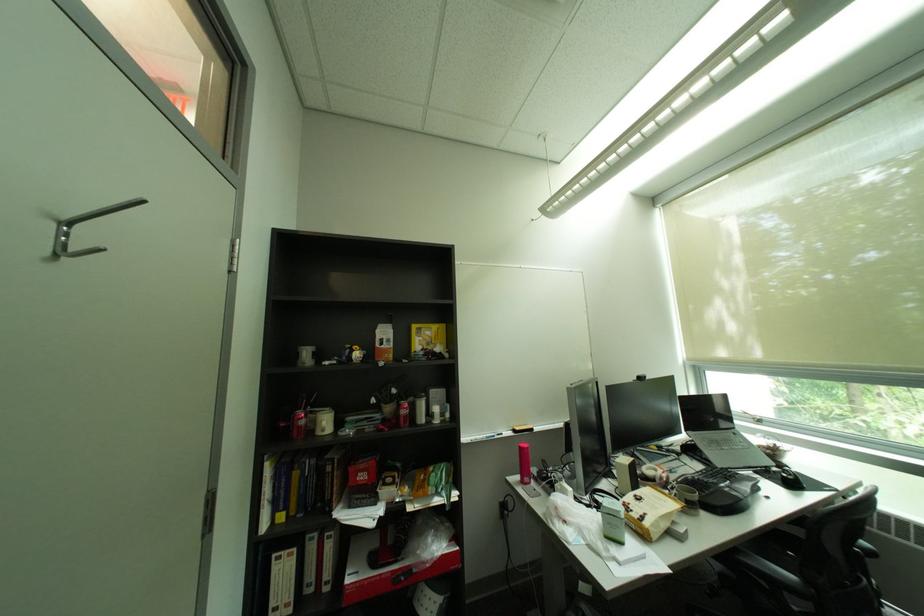
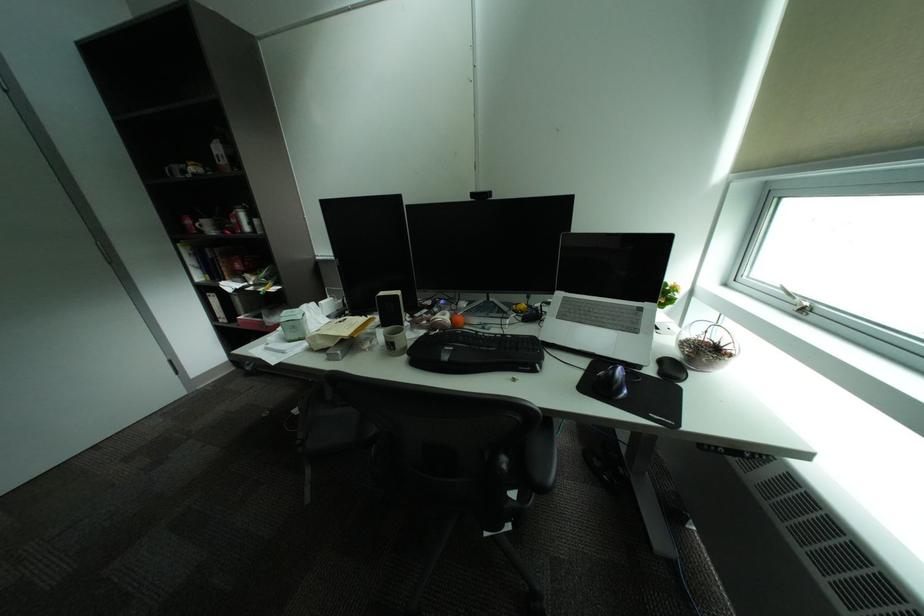
In the second image, find the point that corresponds to point (712, 472) in the first image.

(516, 336)